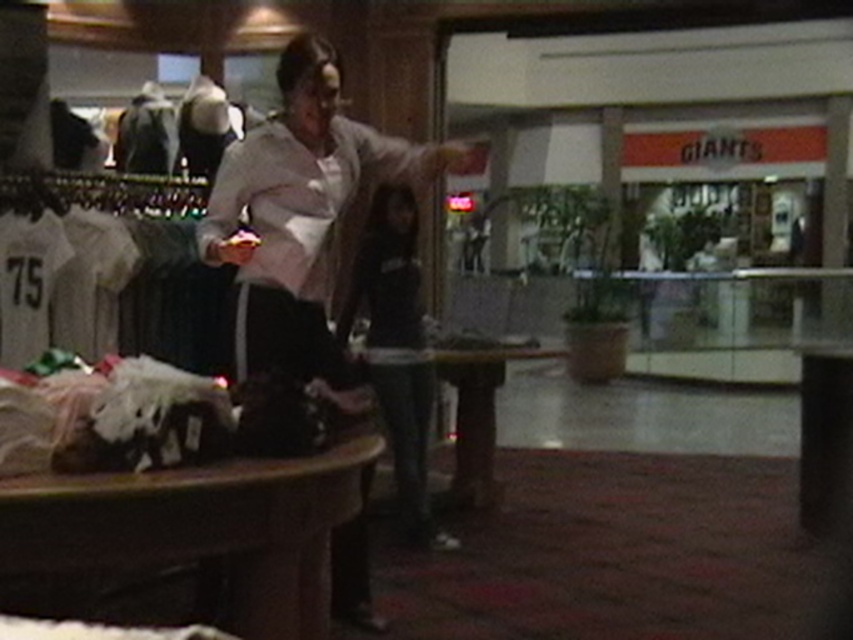
What are the coordinates of the light pink fabric shirt at center?

The light pink fabric shirt at center is located at coordinates point (300, 214).

You are trying to decide which item to take first from the table. Based on their sizes, which item would you need more space to carry comfortably, the light pink fabric shirt at center or the black matte jacket at center?

The light pink fabric shirt at center is wider than the black matte jacket at center, so it would require more space to carry comfortably.